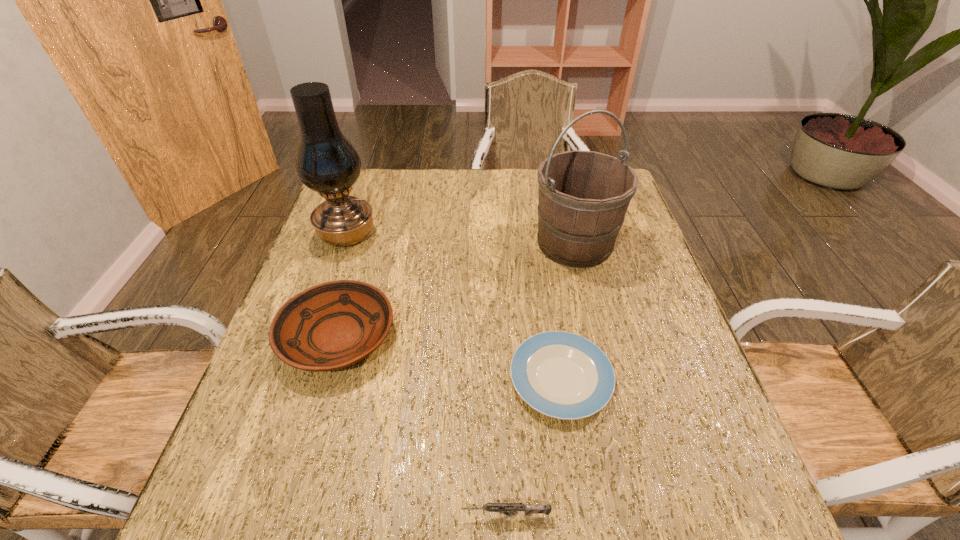
The height and width of the screenshot is (540, 960). I want to click on oil lamp, so click(327, 163).

Locate an element on the screen. This screenshot has height=540, width=960. bucket is located at coordinates (583, 196).

What are the coordinates of `the third shortest object` in the screenshot? It's located at (333, 325).

This screenshot has width=960, height=540. In order to click on the taller plate in this screenshot , I will do `click(333, 325)`.

Identify the location of the nearest object. The width and height of the screenshot is (960, 540). (511, 509).

Where is `the second shortest object`? The height and width of the screenshot is (540, 960). the second shortest object is located at coordinates (511, 509).

This screenshot has height=540, width=960. What are the coordinates of `the right plate` in the screenshot? It's located at (563, 375).

Find the location of a particular element. the shortest object is located at coordinates (563, 375).

Locate an element on the screen. The height and width of the screenshot is (540, 960). vacant region located 0.120m on the back of the oil lamp is located at coordinates (361, 194).

I want to click on vacant space located 0.380m on the front of the bucket, so click(613, 404).